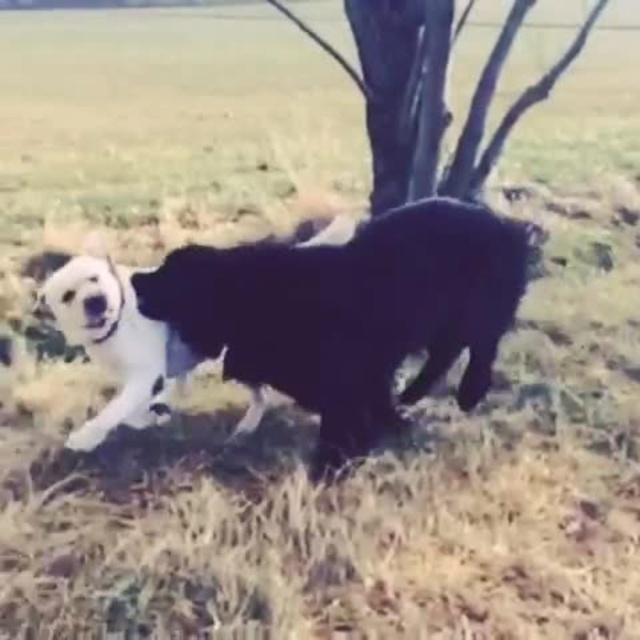
Question: Does black fluffy dog at center appear on the left side of black matte tree at upper center?

Choices:
 (A) no
 (B) yes

Answer: (B)

Question: Among these objects, which one is nearest to the camera?

Choices:
 (A) black matte tree at upper center
 (B) black fluffy dog at center

Answer: (B)

Question: Which object appears closest to the camera in this image?

Choices:
 (A) black matte tree at upper center
 (B) black fluffy dog at center

Answer: (B)

Question: Is black fluffy dog at center further to the viewer compared to black matte tree at upper center?

Choices:
 (A) yes
 (B) no

Answer: (B)

Question: Can you confirm if black fluffy dog at center is positioned below black matte tree at upper center?

Choices:
 (A) yes
 (B) no

Answer: (A)